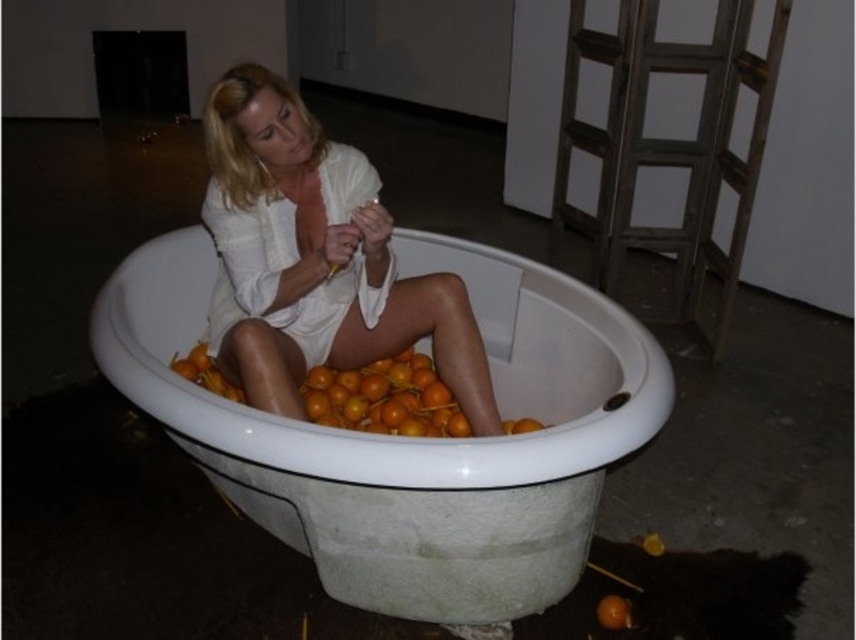
Who is higher up, white matte dress at center or wooden ladder at right?

Positioned higher is wooden ladder at right.

Between white matte dress at center and wooden ladder at right, which one appears on the left side from the viewer's perspective?

Positioned to the left is white matte dress at center.

What do you see at coordinates (314, 259) in the screenshot?
I see `white matte dress at center` at bounding box center [314, 259].

Where is `white matte dress at center`? white matte dress at center is located at coordinates (314, 259).

Based on the photo, does white glossy tub at center have a lesser height compared to white matte dress at center?

Incorrect, white glossy tub at center's height does not fall short of white matte dress at center's.

Is point (355, 477) positioned in front of point (345, 291)?

Yes.

Is point (396, 253) positioned in front of point (330, 278)?

That is False.

You are a GUI agent. You are given a task and a screenshot of the screen. Output one action in this format:
    pyautogui.click(x=<x>, y=<y>)
    Task: Click on the white glossy tub at center
    The image size is (856, 640).
    Given the screenshot: What is the action you would take?
    (x=411, y=438)

Does white matte dress at center appear on the left side of orange matte/orange at center?

Yes, white matte dress at center is to the left of orange matte/orange at center.

Is point (226, 312) positioned in front of point (397, 428)?

Yes, point (226, 312) is closer to viewer.

Image resolution: width=856 pixels, height=640 pixels. In order to click on white matte dress at center in this screenshot , I will do `click(314, 259)`.